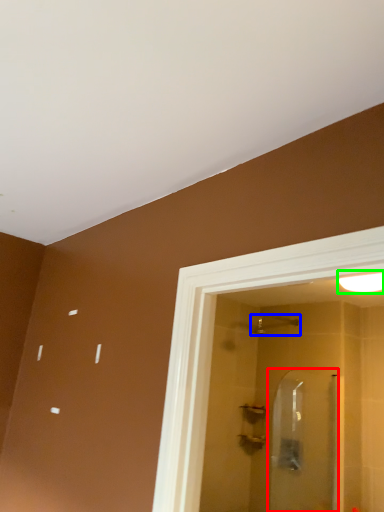
Question: Which object is positioned closest to screen door (highlighted by a red box)? Select from shower (highlighted by a blue box) and light fixture (highlighted by a green box).

Choices:
 (A) shower
 (B) light fixture

Answer: (A)